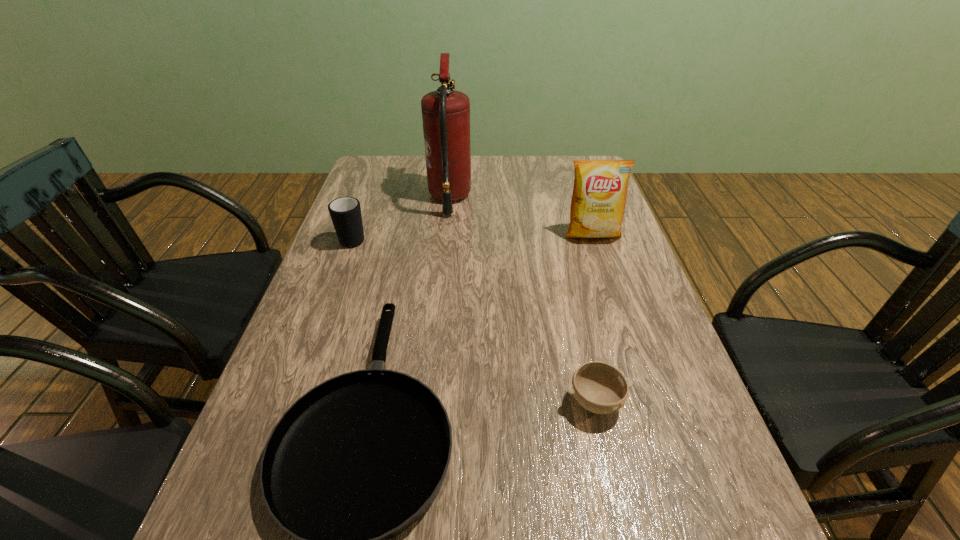
Identify the location of unoccupied area between the third tallest object and the bowl. pyautogui.click(x=474, y=320).

Identify the location of free space that is in between the crisp (potato chip) and the tallest object. The width and height of the screenshot is (960, 540). (521, 216).

Locate an element on the screen. This screenshot has height=540, width=960. free area in between the farthest object and the crisp (potato chip) is located at coordinates (521, 216).

At what (x,y) coordinates should I click in order to perform the action: click on vacant space in between the mug and the crisp (potato chip). Please return your answer as a coordinate pair (x, y). This screenshot has width=960, height=540. Looking at the image, I should click on (473, 236).

Select which object is the third closest to the shortest object. Please provide its 2D coordinates. Your answer should be formatted as a tuple, i.e. [(x, y)], where the tuple contains the x and y coordinates of a point satisfying the conditions above.

[(598, 201)]

The height and width of the screenshot is (540, 960). What are the coordinates of `object that is the second closest to the bowl` in the screenshot? It's located at (598, 201).

Find the location of a particular element. Image resolution: width=960 pixels, height=540 pixels. free location that satisfies the following two spatial constraints: 1. at the front of the bowl where the nozzle is aimed; 2. on the left side of the fire extinguisher is located at coordinates (429, 402).

Where is `free space that satisfies the following two spatial constraints: 1. at the front of the farthest object where the nozzle is aimed; 2. on the right side of the bowl`? free space that satisfies the following two spatial constraints: 1. at the front of the farthest object where the nozzle is aimed; 2. on the right side of the bowl is located at coordinates (429, 402).

Where is `vacant space that satisfies the following two spatial constraints: 1. on the back side of the bowl; 2. at the front of the farthest object where the nozzle is aimed`? The width and height of the screenshot is (960, 540). vacant space that satisfies the following two spatial constraints: 1. on the back side of the bowl; 2. at the front of the farthest object where the nozzle is aimed is located at coordinates (549, 198).